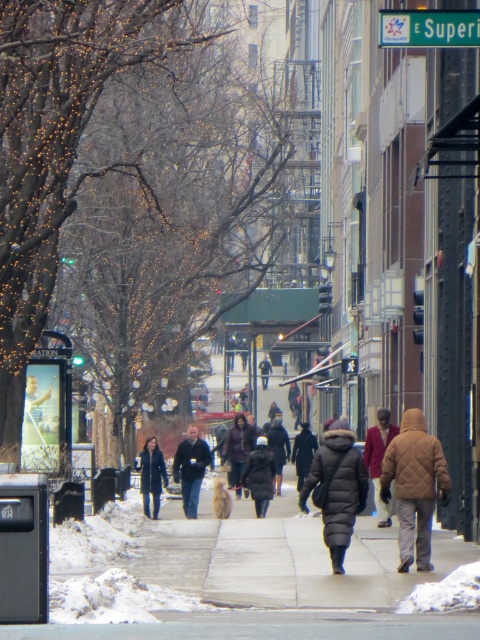
Can you confirm if black puffy coat at center is positioned above dark blue coat at center?

Correct, black puffy coat at center is located above dark blue coat at center.

In the scene shown: Who is shorter, black puffy coat at center or dark blue coat at center?

dark blue coat at center is shorter.

Does point (336, 499) lie behind point (147, 442)?

No, (336, 499) is closer to viewer.

Where is `black puffy coat at center`? This screenshot has height=640, width=480. black puffy coat at center is located at coordinates (337, 488).

Is green plastic street sign at upper center to the right of dark brown leather jacket at center from the viewer's perspective?

Indeed, green plastic street sign at upper center is positioned on the right side of dark brown leather jacket at center.

Describe the element at coordinates (429, 28) in the screenshot. The image size is (480, 640). I see `green plastic street sign at upper center` at that location.

The width and height of the screenshot is (480, 640). I want to click on green plastic street sign at upper center, so click(x=429, y=28).

Does point (432, 468) come farther from viewer compared to point (186, 506)?

No, (432, 468) is closer to viewer.

Measure the distance from brown quilted jacket at center-right to dark blue jacket at center.

brown quilted jacket at center-right is 15.24 meters away from dark blue jacket at center.

The height and width of the screenshot is (640, 480). Describe the element at coordinates (415, 486) in the screenshot. I see `brown quilted jacket at center-right` at that location.

This screenshot has width=480, height=640. I want to click on brown quilted jacket at center-right, so click(415, 486).